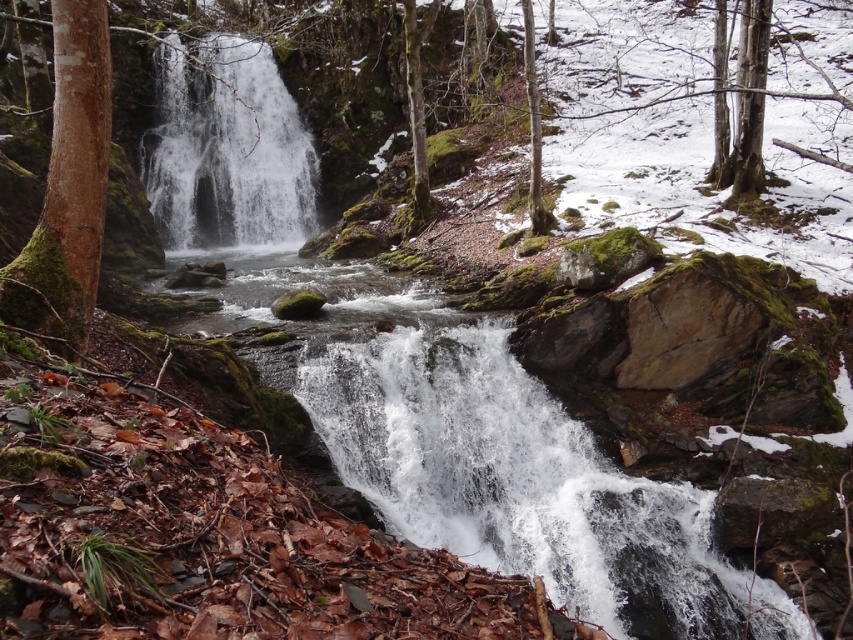
Question: Which point is closer to the camera?

Choices:
 (A) white frothy water at center
 (B) green mossy bark tree at left
 (C) white frothy water at upper center

Answer: (B)

Question: Does white frothy water at center appear under green mossy bark tree at left?

Choices:
 (A) no
 (B) yes

Answer: (B)

Question: Is white frothy water at center positioned before green mossy bark tree at left?

Choices:
 (A) no
 (B) yes

Answer: (A)

Question: Which of the following is the closest to the observer?

Choices:
 (A) white frothy water at upper center
 (B) green mossy bark tree at left
 (C) white frothy water at center

Answer: (B)

Question: Is white frothy water at upper center above green mossy bark tree at left?

Choices:
 (A) yes
 (B) no

Answer: (A)

Question: Among these points, which one is nearest to the camera?

Choices:
 (A) (4, 292)
 (B) (236, 240)
 (C) (294, 268)

Answer: (A)